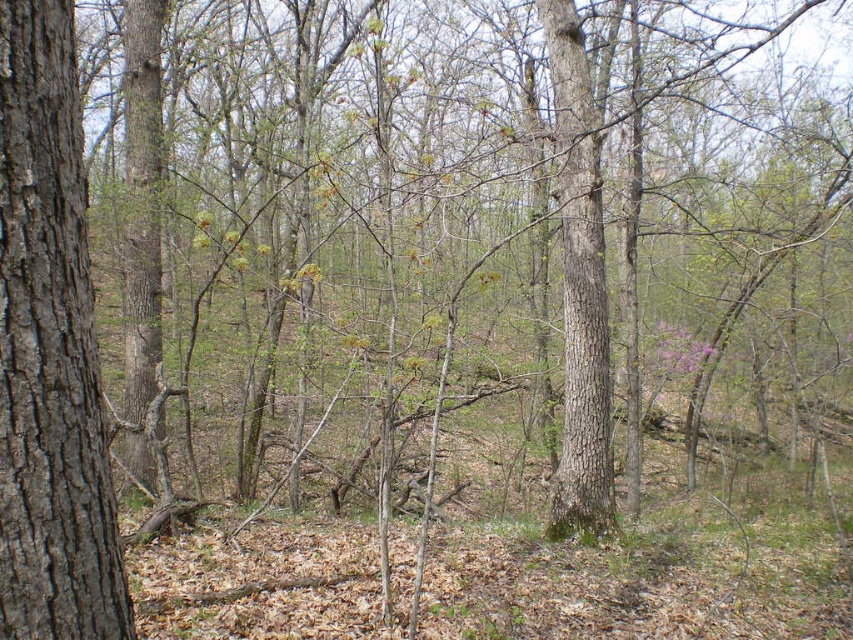
You are a hiker trying to determine which tree trunk takes up more visual space in the forest scene. Based on the image, which one is larger in size between the gray rough bark tree trunk at left and the smooth brown tree trunk at center?

The smooth brown tree trunk at center occupies more space than the gray rough bark tree trunk at left, making it the larger one in size.

From the picture: You are a hiker trying to navigate through the forest. You see a gray rough bark tree trunk at left and another tree trunk. How far apart are they?

The gray rough bark tree trunk at left and the other tree trunk are 7.80 feet apart.

From the picture: You are a hiker carrying a 1.5 meter wide tent. You want to set up camp between the gray rough bark tree trunk at left and the smooth brown tree trunk at center. Can the space between them accommodate your tent?

The gray rough bark tree trunk at left is narrower than the smooth brown tree trunk at center. The space between them is wider than the gray rough bark tree trunk at left. Since the tent is 1.5 meters wide, the available space between the two trees must be at least 1.5 meters. However, the description only states that the gray tree is narrower than the smooth brown one but does not provide exact measurements. Without knowing the exact width of the space between them, it is impossible to determine if the 1.5